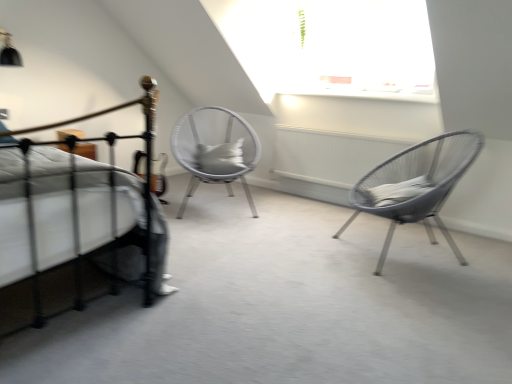
Identify the location of blank area beneath white woven chair at center, positioned as the first chair in left-to-right order (from a real-world perspective). This screenshot has width=512, height=384. (202, 201).